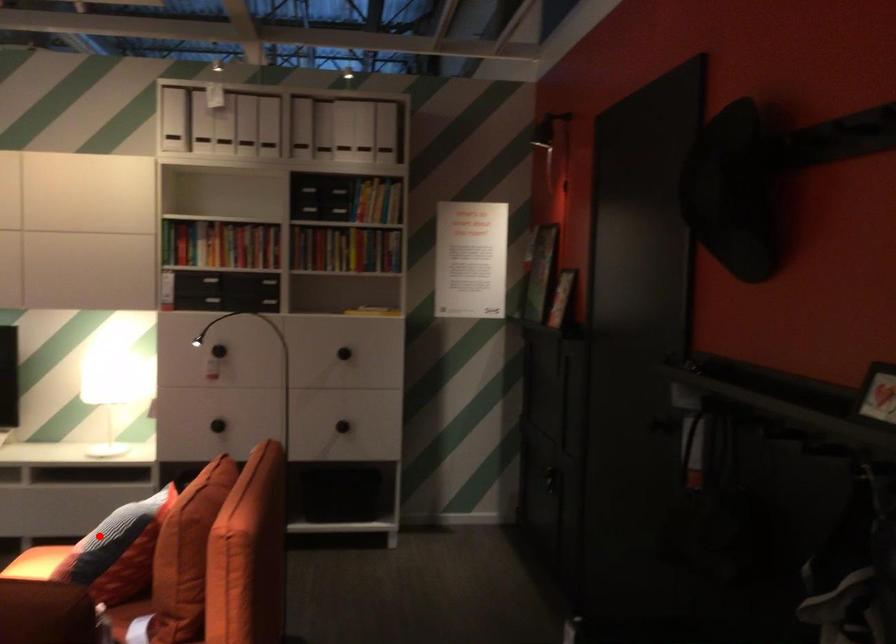
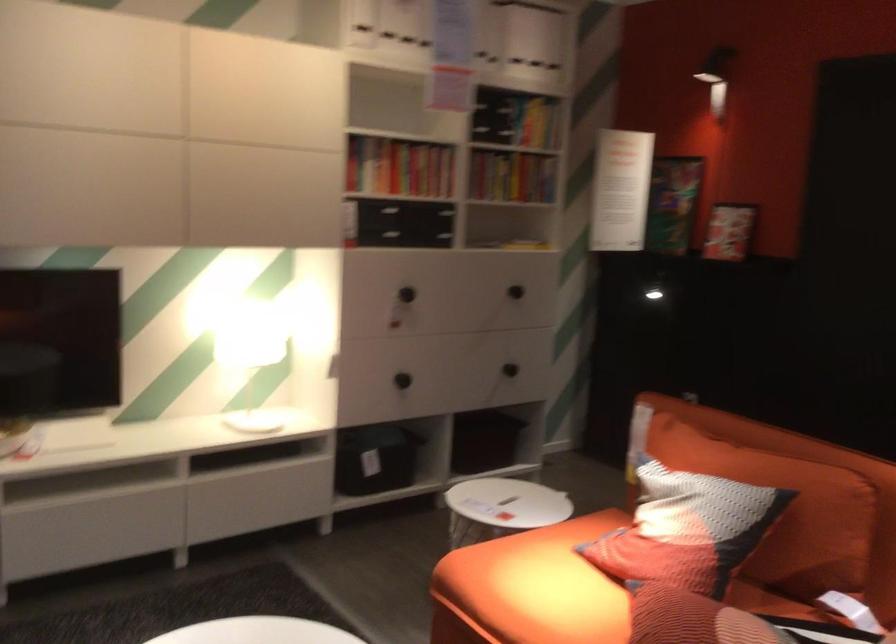
In the second image, find the point that corresponds to the highlighted location in the first image.

(785, 511)